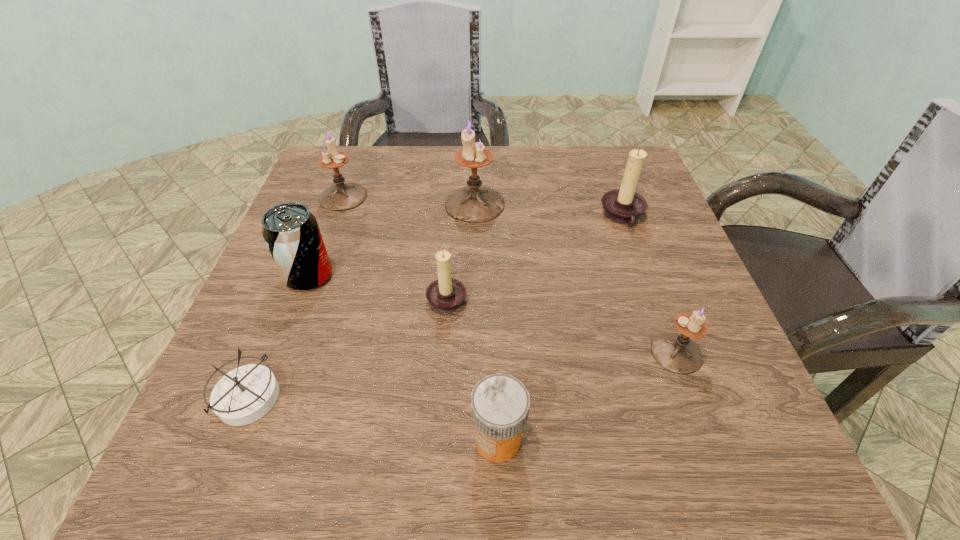
You are a GUI agent. You are given a task and a screenshot of the screen. Output one action in this format:
    pyautogui.click(x=<x>, y=<y>)
    Task: Click on the free spot located 0.070m on the wick of the nearer brown candle holder
    Image resolution: width=960 pixels, height=540 pixels.
    Given the screenshot: What is the action you would take?
    pyautogui.click(x=504, y=296)

Find the location of `free location located 0.180m on the label side of the orange medicine`. free location located 0.180m on the label side of the orange medicine is located at coordinates pos(348,439).

The width and height of the screenshot is (960, 540). I want to click on vacant space located 0.300m on the label side of the orange medicine, so click(x=267, y=439).

The height and width of the screenshot is (540, 960). In order to click on vacant space situated 0.300m on the label side of the orange medicine in this screenshot , I will do `click(267, 439)`.

Locate an element on the screen. vacant space located on the right of the compass is located at coordinates (391, 400).

What are the coordinates of `medicine positioned at the near edge` in the screenshot? It's located at (500, 403).

Find the location of `compass located in the near edge section of the desktop`. compass located in the near edge section of the desktop is located at coordinates (244, 395).

Identify the location of candle holder positioned at the left edge. Image resolution: width=960 pixels, height=540 pixels. (341, 196).

Locate an element on the screen. This screenshot has height=540, width=960. soda can that is at the left edge is located at coordinates (291, 232).

Where is `compass positioned at the left edge`? compass positioned at the left edge is located at coordinates (244, 395).